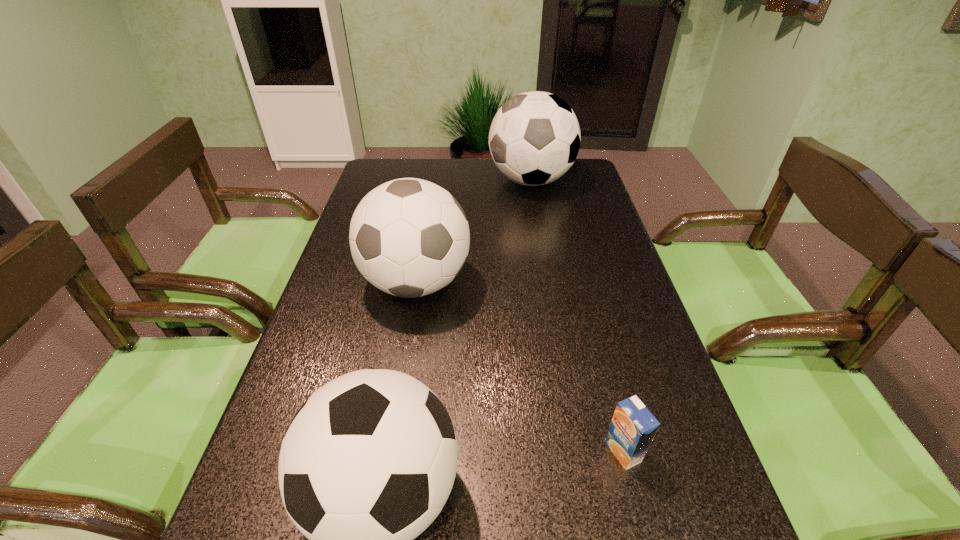
The height and width of the screenshot is (540, 960). I want to click on vacant area between the rightmost soccer ball and the shortest object, so pyautogui.click(x=577, y=316).

At what (x,y) coordinates should I click in order to perform the action: click on free space between the third nearest object and the rightmost soccer ball. Please return your answer as a coordinate pair (x, y). Looking at the image, I should click on (473, 232).

Identify which object is the nearest to the nearest soccer ball. Please provide its 2D coordinates. Your answer should be formatted as a tuple, i.e. [(x, y)], where the tuple contains the x and y coordinates of a point satisfying the conditions above.

[(632, 429)]

At what (x,y) coordinates should I click in order to perform the action: click on the third closest object relative to the farthest object. Please return your answer as a coordinate pair (x, y). Looking at the image, I should click on tap(632, 429).

Locate which soccer ball is the third closest to the shortest object. Please provide its 2D coordinates. Your answer should be formatted as a tuple, i.e. [(x, y)], where the tuple contains the x and y coordinates of a point satisfying the conditions above.

[(534, 138)]

The image size is (960, 540). Find the location of `soccer ball that stands as the closest to the second farthest object`. soccer ball that stands as the closest to the second farthest object is located at coordinates (534, 138).

The width and height of the screenshot is (960, 540). I want to click on vacant area that satisfies the following two spatial constraints: 1. on the main logo of the farthest soccer ball; 2. on the back side of the shortest object, so click(x=579, y=451).

Locate an element on the screen. free spot that satisfies the following two spatial constraints: 1. on the main logo of the rightmost soccer ball; 2. on the front side of the third nearest object is located at coordinates (549, 283).

You are a GUI agent. You are given a task and a screenshot of the screen. Output one action in this format:
    pyautogui.click(x=<x>, y=<y>)
    Task: Click on the vacant position in the image that satisfies the following two spatial constraints: 1. on the main logo of the farthest object; 2. on the right side of the orange_juice
    
    Given the screenshot: What is the action you would take?
    pyautogui.click(x=579, y=451)

Find the location of a particular element. vacant area in the image that satisfies the following two spatial constraints: 1. on the main logo of the farthest object; 2. on the front side of the third nearest object is located at coordinates (549, 283).